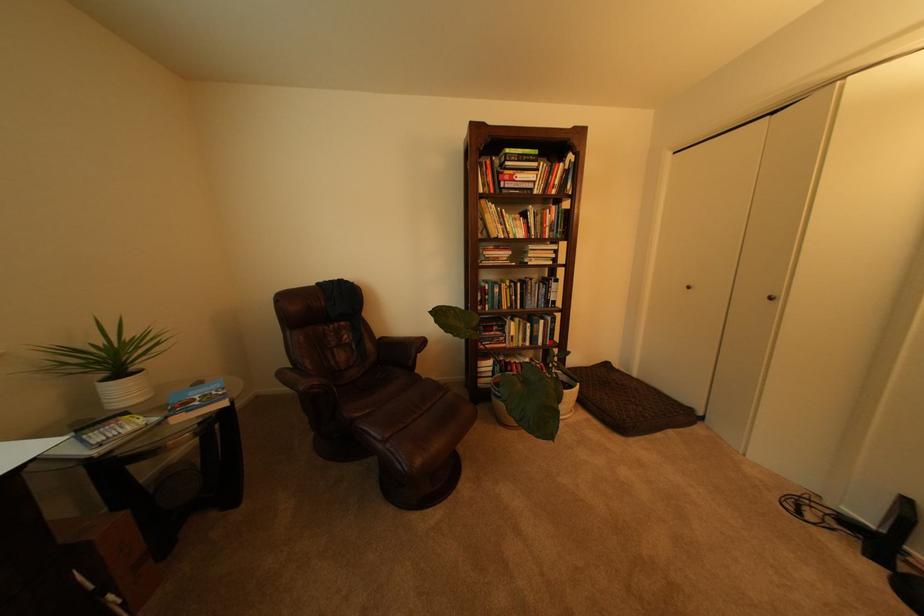
Find the location of `silver door knob`. silver door knob is located at coordinates (776, 299).